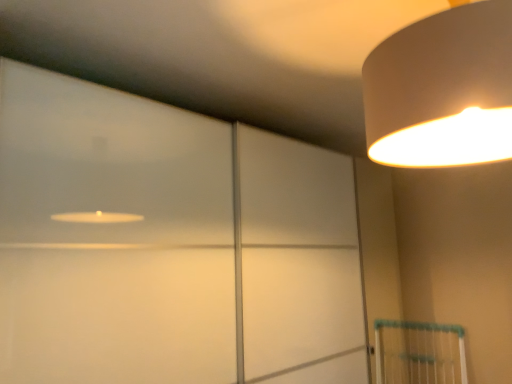
Identify the location of white matte lampshade at upper right. This screenshot has width=512, height=384. (442, 90).

What do you see at coordinates (442, 90) in the screenshot? I see `white matte lampshade at upper right` at bounding box center [442, 90].

What do you see at coordinates (168, 244) in the screenshot?
I see `transparent glass door at upper left` at bounding box center [168, 244].

The height and width of the screenshot is (384, 512). Identify the location of transparent glass door at upper left. (168, 244).

This screenshot has height=384, width=512. In order to click on white matte lampshade at upper right in this screenshot , I will do `click(442, 90)`.

Which object is positioned more to the left, transparent glass door at upper left or white matte lampshade at upper right?

transparent glass door at upper left is more to the left.

Which is behind, transparent glass door at upper left or white matte lampshade at upper right?

transparent glass door at upper left is more distant.

Is point (103, 376) farther from viewer compared to point (432, 112)?

That is True.

From the image's perspective, between transparent glass door at upper left and white matte lampshade at upper right, who is located below?

transparent glass door at upper left, from the image's perspective.

From a real-world perspective, is transparent glass door at upper left physically below white matte lampshade at upper right?

Yes, from a real-world perspective, transparent glass door at upper left is under white matte lampshade at upper right.

Between transparent glass door at upper left and white matte lampshade at upper right, which one has smaller width?

transparent glass door at upper left is thinner.

Is transparent glass door at upper left taller or shorter than white matte lampshade at upper right?

In the image, transparent glass door at upper left appears to be taller than white matte lampshade at upper right.

Is transparent glass door at upper left smaller than white matte lampshade at upper right?

No.

Is transparent glass door at upper left situated inside white matte lampshade at upper right or outside?

transparent glass door at upper left cannot be found inside white matte lampshade at upper right.

Is transparent glass door at upper left not near white matte lampshade at upper right?

No, transparent glass door at upper left is in close proximity to white matte lampshade at upper right.

Is transparent glass door at upper left facing away from white matte lampshade at upper right?

No, transparent glass door at upper left is not facing the opposite direction of white matte lampshade at upper right.

How many degrees apart are the facing directions of transparent glass door at upper left and white matte lampshade at upper right?

179 degrees.

In order to click on glass door that is under the white matte lampshade at upper right (from a real-world perspective) in this screenshot , I will do `click(168, 244)`.

Considering the relative positions of white matte lampshade at upper right and transparent glass door at upper left in the image provided, is white matte lampshade at upper right to the right of transparent glass door at upper left from the viewer's perspective?

Yes.

Relative to transparent glass door at upper left, is white matte lampshade at upper right in front or behind?

white matte lampshade at upper right is positioned closer to the viewer than transparent glass door at upper left.

Which is in front, point (422, 155) or point (291, 261)?

The point (422, 155) is closer.

From the image's perspective, who appears lower, white matte lampshade at upper right or transparent glass door at upper left?

transparent glass door at upper left appears lower in the image.

From a real-world perspective, between white matte lampshade at upper right and transparent glass door at upper left, who is vertically lower?

transparent glass door at upper left, from a real-world perspective.

Which of these two, white matte lampshade at upper right or transparent glass door at upper left, is wider?

With larger width is white matte lampshade at upper right.

Considering the sizes of white matte lampshade at upper right and transparent glass door at upper left in the image, is white matte lampshade at upper right taller or shorter than transparent glass door at upper left?

Considering their sizes, white matte lampshade at upper right has less height than transparent glass door at upper left.

Is white matte lampshade at upper right bigger or smaller than transparent glass door at upper left?

Clearly, white matte lampshade at upper right is smaller in size than transparent glass door at upper left.

Is transparent glass door at upper left located within white matte lampshade at upper right?

Actually, transparent glass door at upper left is outside white matte lampshade at upper right.

Is white matte lampshade at upper right in contact with transparent glass door at upper left?

No, white matte lampshade at upper right is not making contact with transparent glass door at upper left.

Does white matte lampshade at upper right turn towards transparent glass door at upper left?

Yes, white matte lampshade at upper right is facing transparent glass door at upper left.

Find the location of a particular element. The image size is (512, 384). lamp in front of the transparent glass door at upper left is located at coordinates (442, 90).

At what (x,y) coordinates should I click in order to perform the action: click on lamp above the transparent glass door at upper left (from a real-world perspective). Please return your answer as a coordinate pair (x, y). The width and height of the screenshot is (512, 384). Looking at the image, I should click on (442, 90).

Locate an element on the screen. glass door below the white matte lampshade at upper right (from the image's perspective) is located at coordinates (168, 244).